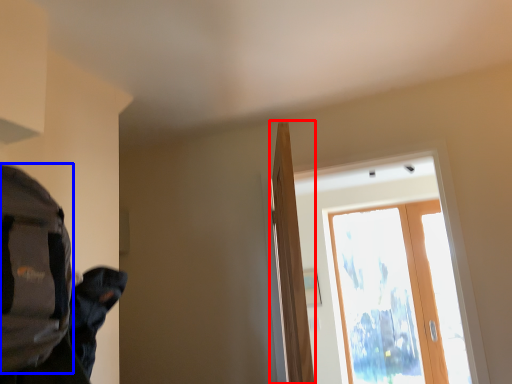
Question: Which of the following is the farthest to the observer, door (highlighted by a red box) or backpack (highlighted by a blue box)?

Choices:
 (A) door
 (B) backpack

Answer: (A)